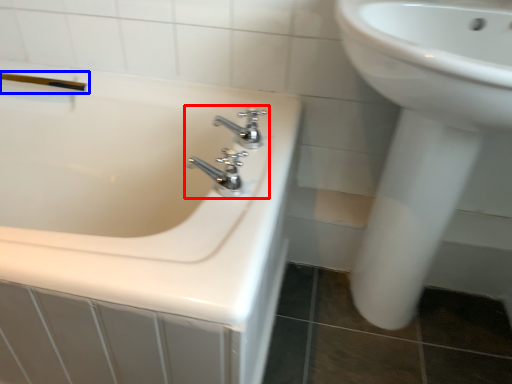
Question: Among these objects, which one is nearest to the camera, tap (highlighted by a red box) or shower (highlighted by a blue box)?

Choices:
 (A) tap
 (B) shower

Answer: (A)